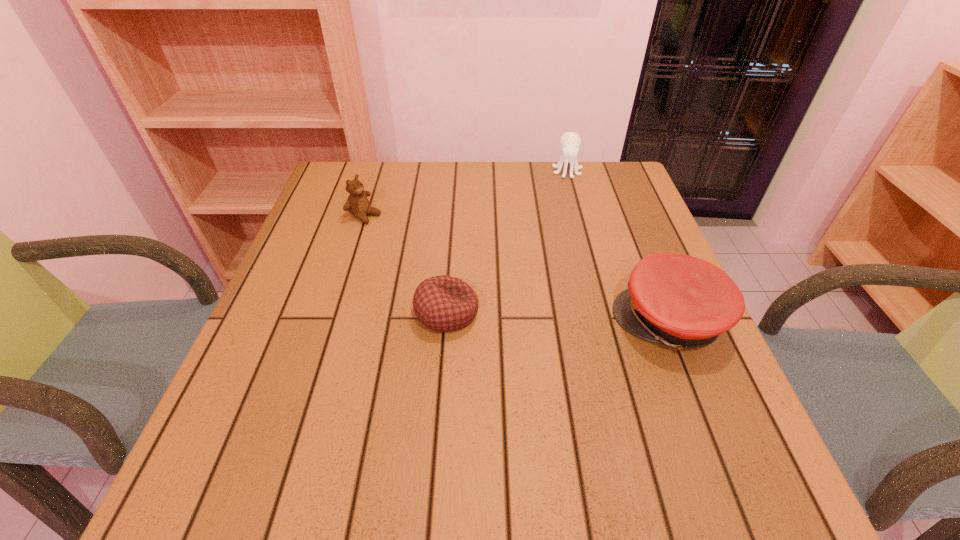
Locate an element on the screen. The width and height of the screenshot is (960, 540). vacant area that lies between the second farthest object and the shortest object is located at coordinates (406, 264).

The width and height of the screenshot is (960, 540). In order to click on free spot between the teddy bear and the octopus in this screenshot , I will do `click(466, 193)`.

The width and height of the screenshot is (960, 540). What are the coordinates of `free area in between the leftmost object and the shortest object` in the screenshot? It's located at (406, 264).

This screenshot has height=540, width=960. I want to click on free area in between the beanbag and the cap, so click(x=558, y=317).

Image resolution: width=960 pixels, height=540 pixels. In order to click on empty location between the octopus and the cap in this screenshot , I will do `click(618, 246)`.

Image resolution: width=960 pixels, height=540 pixels. In order to click on vacant space that's between the cap and the octopus in this screenshot , I will do `click(618, 246)`.

At what (x,y) coordinates should I click in order to perform the action: click on free space between the second farthest object and the cap. Please return your answer as a coordinate pair (x, y). This screenshot has height=540, width=960. Looking at the image, I should click on (517, 268).

You are a GUI agent. You are given a task and a screenshot of the screen. Output one action in this format:
    pyautogui.click(x=<x>, y=<y>)
    Task: Click on the free space between the farthest object and the beanbag
    The width and height of the screenshot is (960, 540).
    Given the screenshot: What is the action you would take?
    pyautogui.click(x=507, y=242)

What are the coordinates of `vacant space in between the cap and the shortest object` in the screenshot? It's located at (558, 317).

Identify the location of the third closest object to the cap. The height and width of the screenshot is (540, 960). (357, 204).